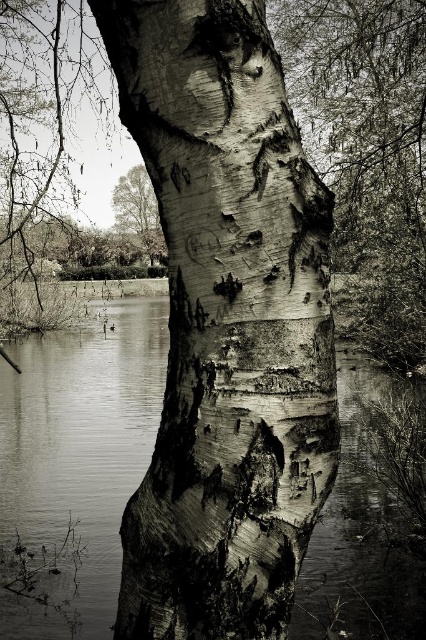
Based on the photo, based on the scene described, which object occupies more vertical space in the image? Please consider the smooth bark tree trunk at center and the smooth water at center in your answer.

The smooth water at center occupies more vertical space than the smooth bark tree trunk at center because the description states that the smooth bark tree trunk at center has a lesser height compared to the smooth water at center.

Based on the scene described, which object is smaller in size between the smooth bark tree trunk at center and the smooth water at center?

The smooth bark tree trunk at center has a smaller size compared to the smooth water at center.